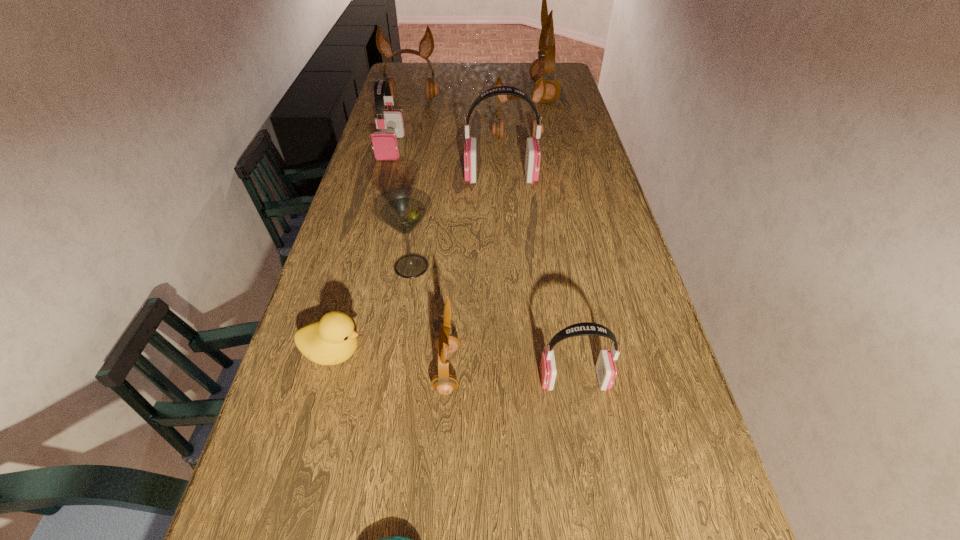
Image resolution: width=960 pixels, height=540 pixels. I want to click on object that is at the far right corner, so click(x=544, y=65).

In the image, there is a desktop. Where is `vacant space at the far edge`? The image size is (960, 540). vacant space at the far edge is located at coordinates (497, 64).

Image resolution: width=960 pixels, height=540 pixels. Find the location of `vacant area at the right edge of the desktop`. vacant area at the right edge of the desktop is located at coordinates (580, 121).

You are a GUI agent. You are given a task and a screenshot of the screen. Output one action in this format:
    pyautogui.click(x=<x>, y=<y>)
    Task: Click on the vacant space that's between the fifth nearest object and the biggest pink earphone
    
    Given the screenshot: What is the action you would take?
    pyautogui.click(x=456, y=221)

Identify the location of vacant space that's between the nearest pink earphone and the second biggest brown earphone. (493, 240).

Find the location of a particular element. vacant area between the martini and the smallest pink earphone is located at coordinates (492, 323).

Find the location of a particular element. This screenshot has width=960, height=540. unoccupied position between the third farthest brown earphone and the duck is located at coordinates (425, 245).

This screenshot has width=960, height=540. Identify the location of empty location between the fifth farthest earphone and the tallest object. (522, 135).

Find the location of `vacant space that is in between the third biggest brown earphone and the duck`. vacant space that is in between the third biggest brown earphone and the duck is located at coordinates (425, 245).

You are a GUI agent. You are given a task and a screenshot of the screen. Output one action in this format:
    pyautogui.click(x=<x>, y=<y>)
    Task: Click on the free space between the martini and the smallest brown earphone
    
    Given the screenshot: What is the action you would take?
    pyautogui.click(x=429, y=318)